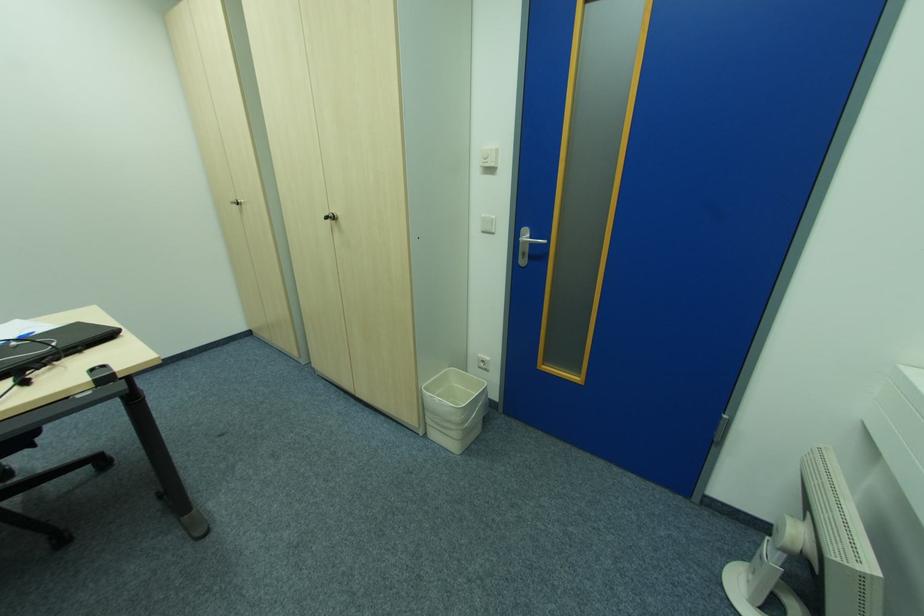
Find the location of `silver door handle`. silver door handle is located at coordinates (526, 245).